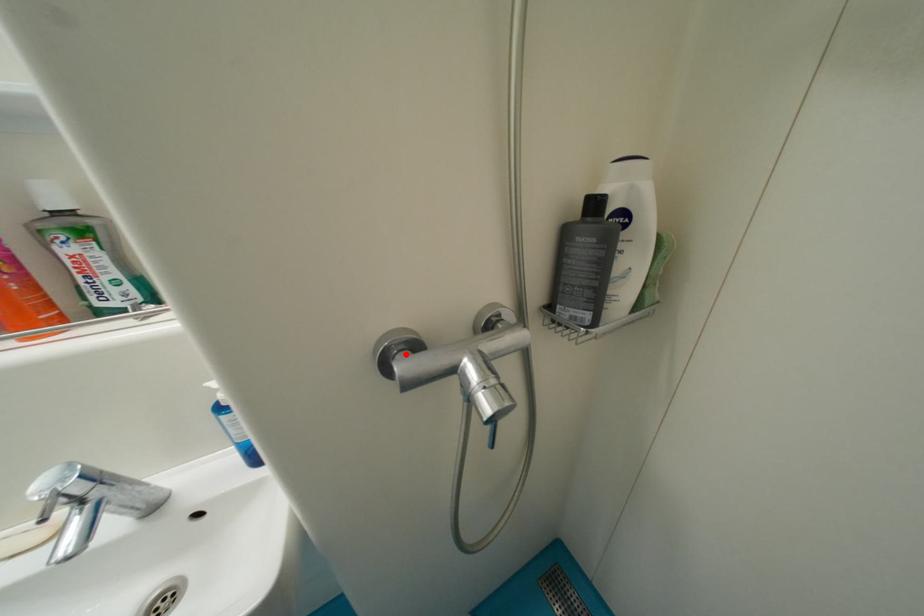
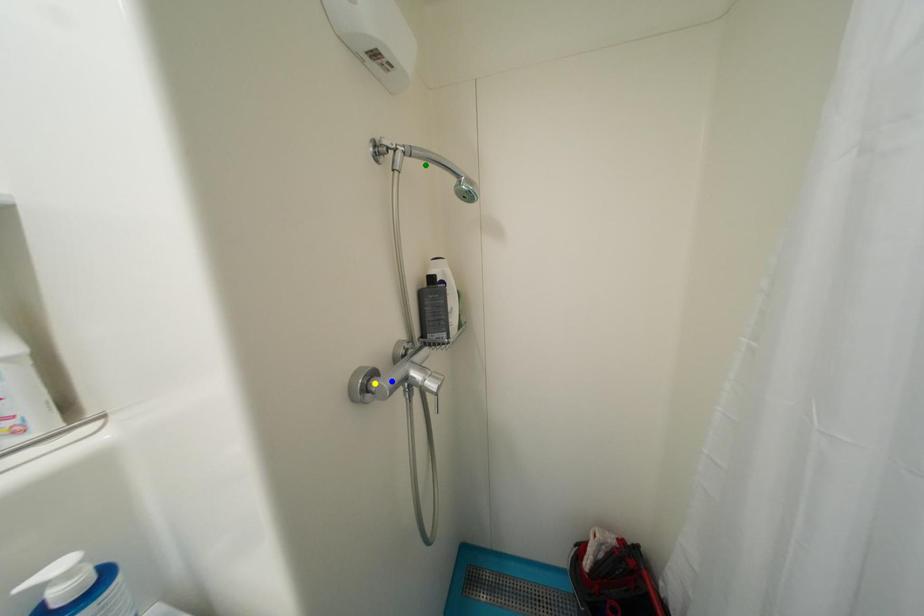
Question: I am providing you with two images of the same scene from different viewpoints. A red point is marked on the first image. You are given multiple points on the second image. Can you choose the point in image 2 that corresponds to the point in image 1?

Choices:
 (A) green point
 (B) yellow point
 (C) blue point

Answer: (B)